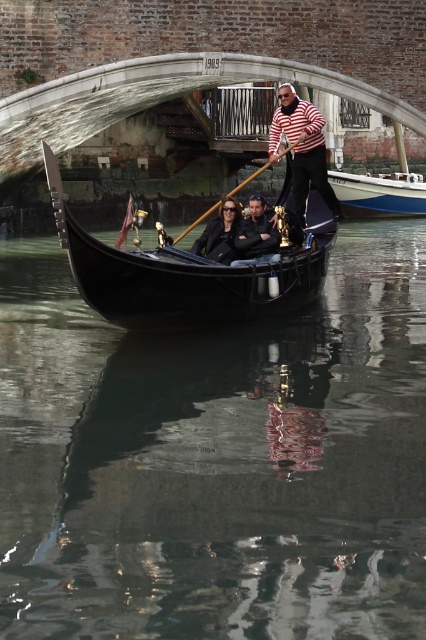
You are a tourist standing on the canal bank and want to take a photo of the striped cotton shirt at center and the concrete stone bridge at center. Which object should you focus on first if you want to capture both in a single frame without moving the camera?

The concrete stone bridge at center has a larger size compared to striped cotton shirt at center, so you should focus on the concrete stone bridge at center first to ensure it fits properly in the frame before adjusting for the smaller striped cotton shirt at center.

You are a tourist standing on the bank of the canal and want to take a photo of the striped cotton shirt at center and the concrete stone bridge at center. Which object should you focus on first to ensure both are in the frame?

You should focus on the concrete stone bridge at center first because it is closer to you than the striped cotton shirt at center, ensuring both are in the frame.

In the scene shown: You are standing on the stone bridge in Venice and want to locate the glossy black water at center. According to the coordinates provided, where should you look relative to the bridge?

The glossy black water at center is located at coordinates point (216, 460), so you should look downward towards the center of the canal below the bridge to find it.